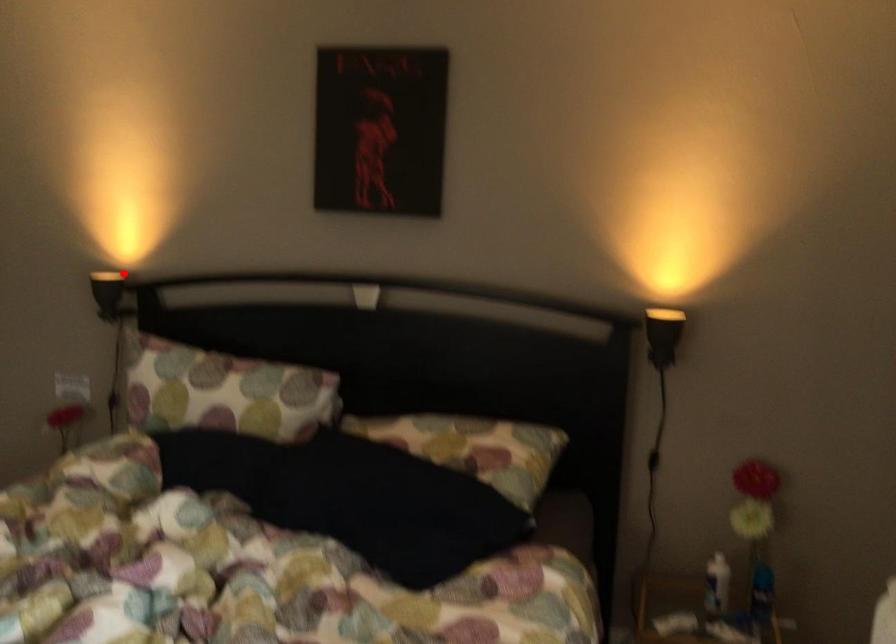
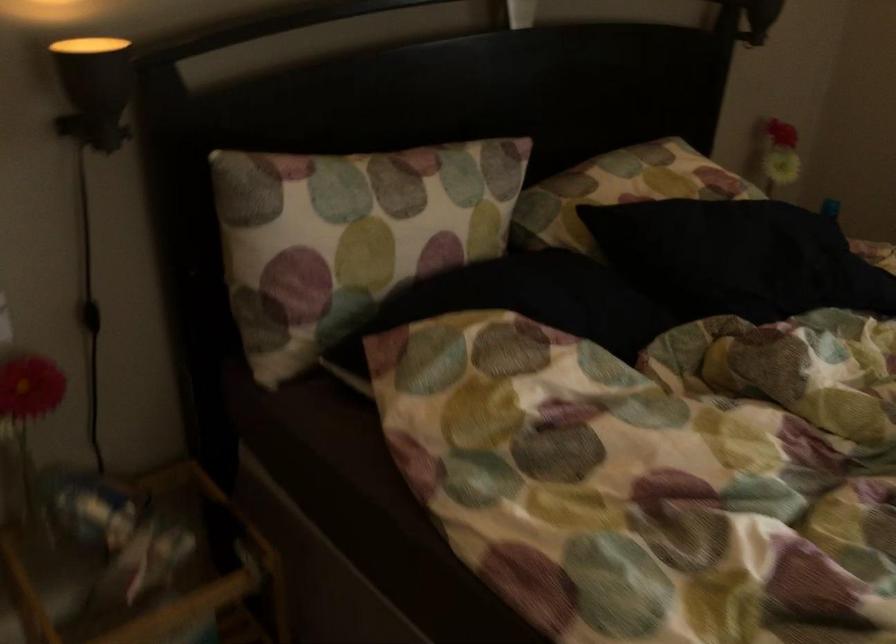
Question: I am providing you with two images of the same scene from different viewpoints. In image1, a red point is highlighted. Considering the same 3D point in image2, which of the following is correct?

Choices:
 (A) It is closer
 (B) It is farther

Answer: (A)